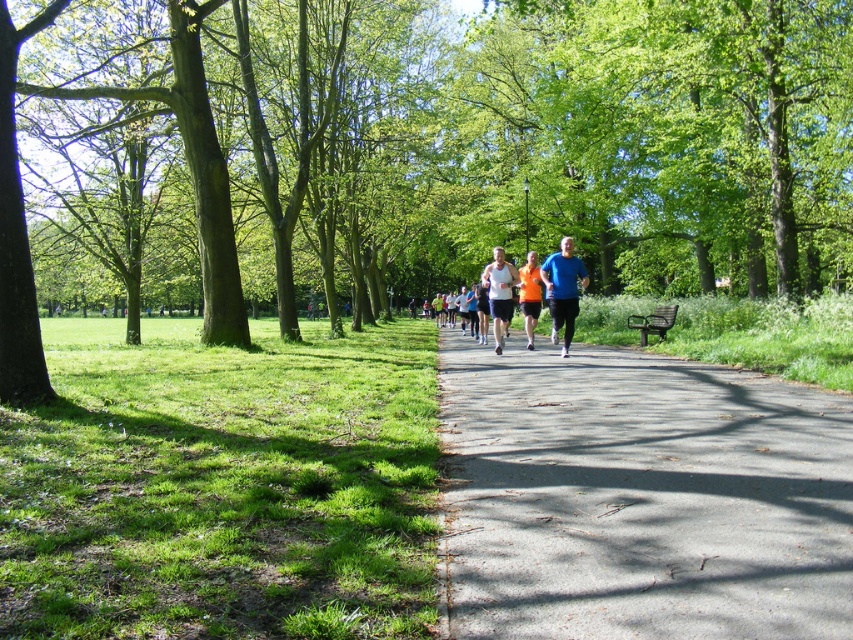
Question: Which object is farther from the camera taking this photo?

Choices:
 (A) matte white tank top at center
 (B) green leafy tree at center

Answer: (A)

Question: Is green leafy tree at center to the right of matte white tank top at center from the viewer's perspective?

Choices:
 (A) yes
 (B) no

Answer: (B)

Question: Which object is farther from the camera taking this photo?

Choices:
 (A) asphalt road at center
 (B) orange fabric shirt at center
 (C) blue fabric shirt at center

Answer: (B)

Question: Estimate the real-world distances between objects in this image. Which object is farther from the green leafy tree at center?

Choices:
 (A) blue fabric shirt at center
 (B) orange fabric shirt at center
 (C) matte white tank top at center

Answer: (A)

Question: Is green leafy tree at center wider than asphalt road at center?

Choices:
 (A) no
 (B) yes

Answer: (B)

Question: Where is green leafy tree at center located in relation to blue fabric shirt at center in the image?

Choices:
 (A) below
 (B) above

Answer: (B)